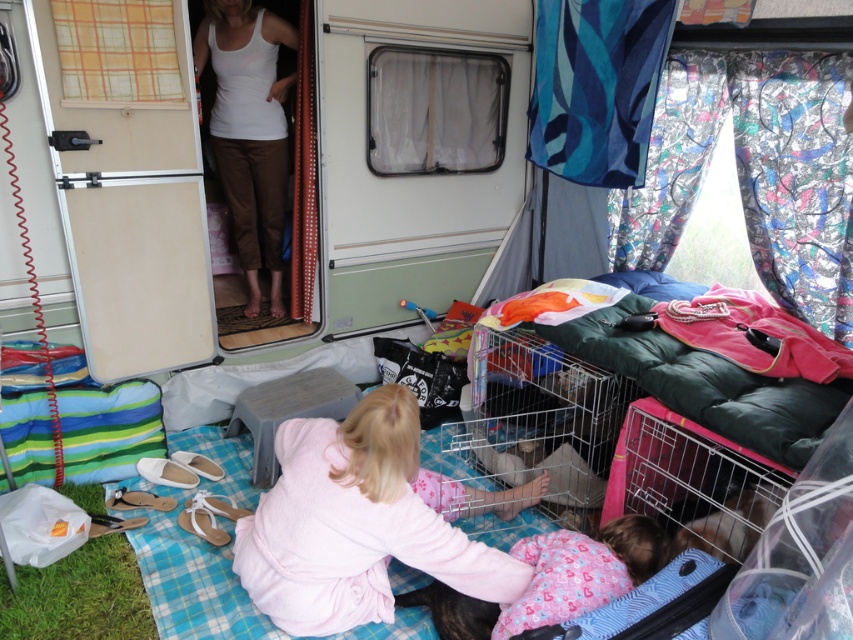
Question: Can you confirm if pink fleece blanket at lower center is positioned to the left of white matte tank top at upper center?

Choices:
 (A) yes
 (B) no

Answer: (B)

Question: Is pink fleece blanket at lower center in front of white matte tank top at upper center?

Choices:
 (A) no
 (B) yes

Answer: (B)

Question: Which point is farther to the camera?

Choices:
 (A) white matte tank top at upper center
 (B) pink fleece blanket at lower center

Answer: (A)

Question: Is pink fleece blanket at lower center bigger than white matte tank top at upper center?

Choices:
 (A) no
 (B) yes

Answer: (A)